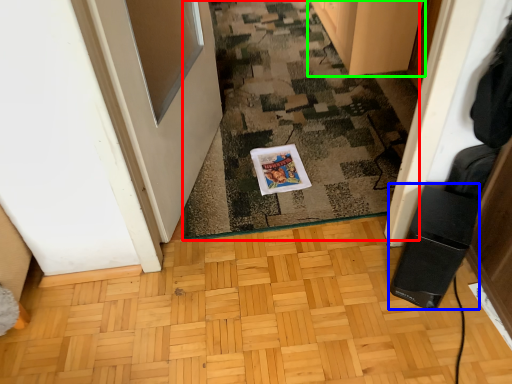
Question: Which object is the closest to the doormat (highlighted by a red box)? Choose among these: appliance (highlighted by a blue box) or cabinetry (highlighted by a green box).

Choices:
 (A) appliance
 (B) cabinetry

Answer: (B)